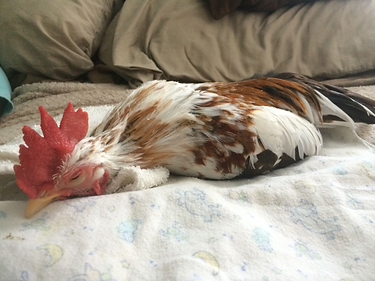
In order to click on blanket in this screenshot , I will do `click(223, 234)`, `click(72, 88)`.